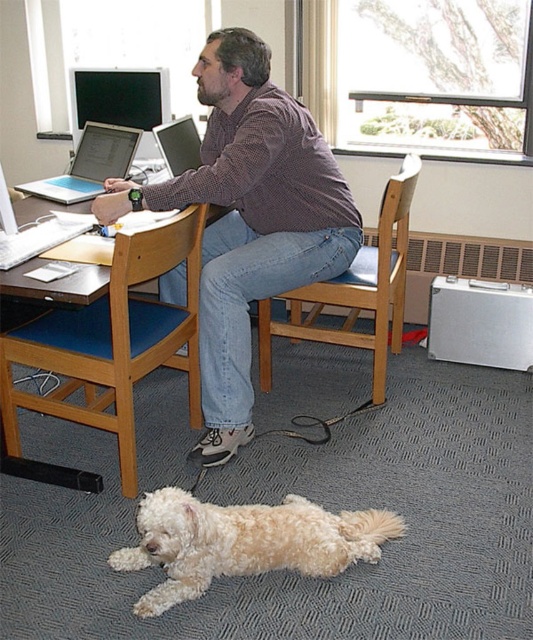
Question: Can you confirm if matte black monitor at upper left is positioned to the left of silver metallic laptop at center?

Choices:
 (A) yes
 (B) no

Answer: (B)

Question: Which is farther from the brown wood computer desk at center?

Choices:
 (A) matte brown shirt at center
 (B) matte black monitor at upper left

Answer: (B)

Question: Estimate the real-world distances between objects in this image. Which object is closer to the brown wood computer desk at center?

Choices:
 (A) silver metallic laptop at center
 (B) matte black monitor at upper left
 (C) white fluffy dog at lower center
 (D) silver metallic laptop at left

Answer: (D)

Question: Which point is farther to the camera?

Choices:
 (A) matte brown shirt at center
 (B) matte black monitor at upper left
 (C) white fluffy dog at lower center

Answer: (B)

Question: Can you confirm if matte brown shirt at center is smaller than matte black monitor at upper left?

Choices:
 (A) no
 (B) yes

Answer: (A)

Question: Considering the relative positions of matte black monitor at upper left and silver metallic laptop at center in the image provided, where is matte black monitor at upper left located with respect to silver metallic laptop at center?

Choices:
 (A) left
 (B) right

Answer: (B)